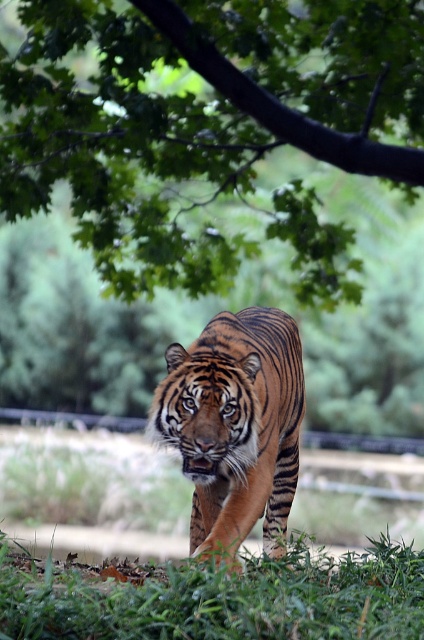
In the scene shown: You are a photographer trying to capture the tiger in the image. You notice two points marked in the scene. Which point, point (x=334, y=616) or point (x=281, y=413), is closer to you?

Point (x=334, y=616) is closer to the viewer than point (x=281, y=413).